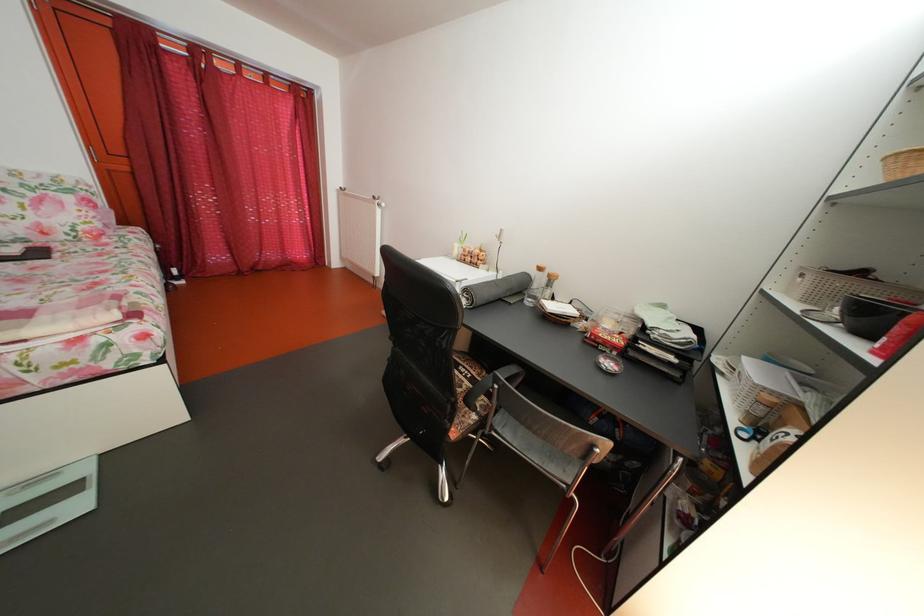
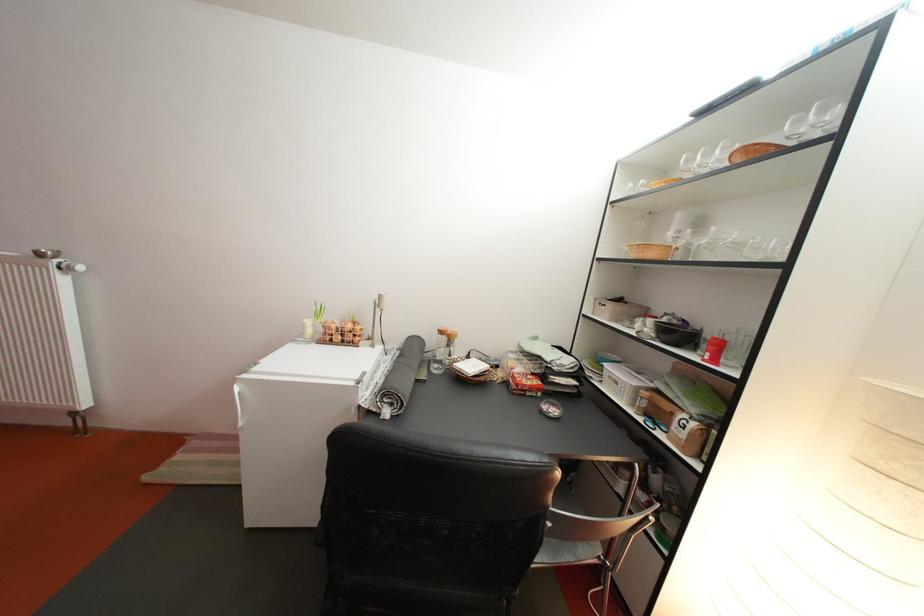
Where in the second image is the point corresponding to (x=551, y=275) from the first image?

(453, 339)